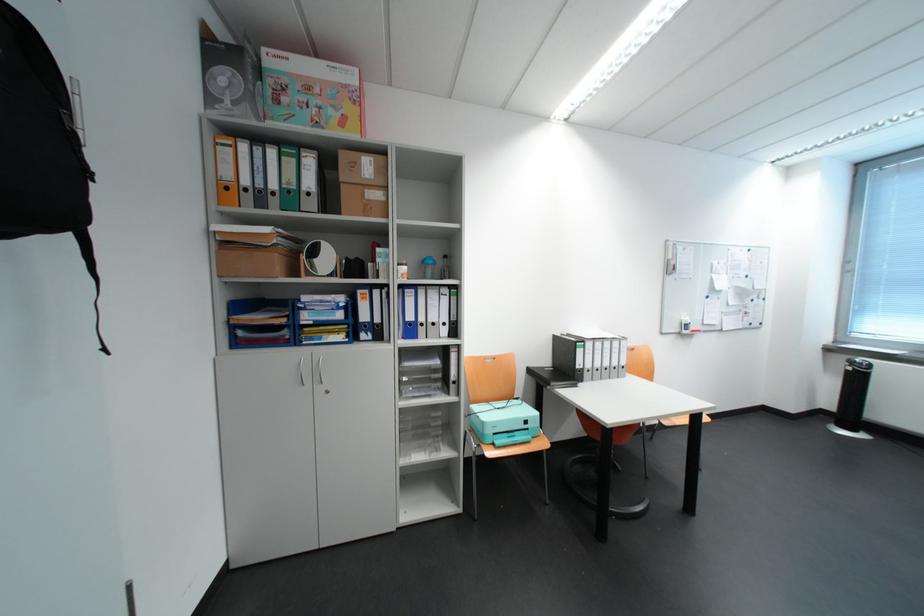
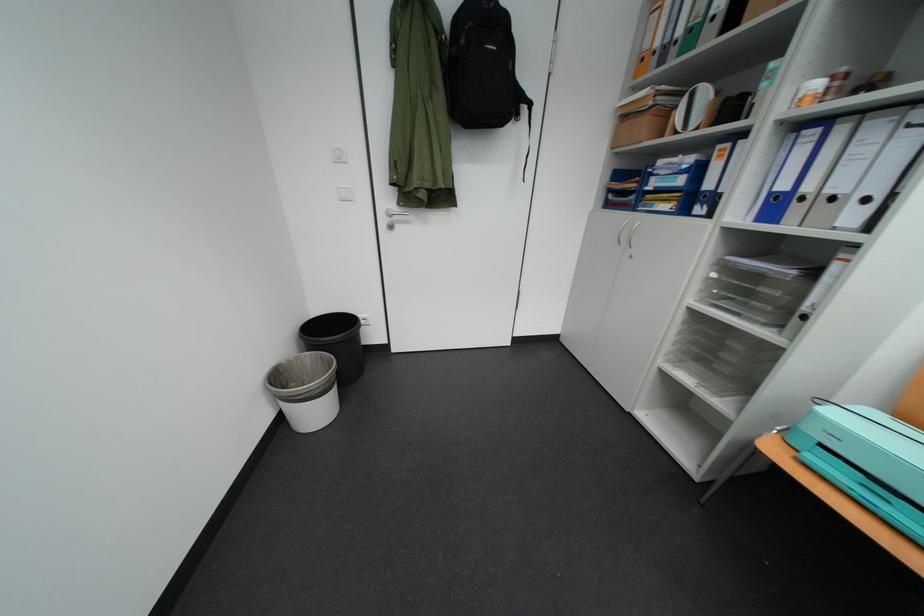
Where in the second image is the point corresponding to pixel 424 321 from the first image?

(799, 190)